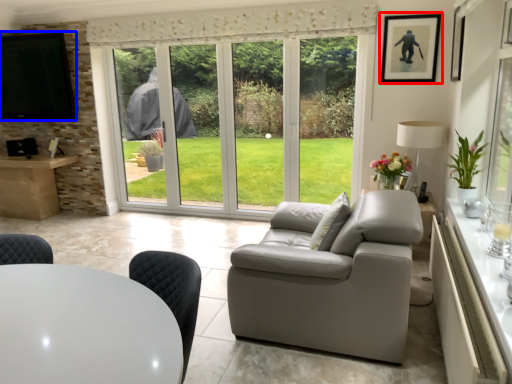
Question: Which of the following is the closest to the observer, picture frame (highlighted by a red box) or window screen (highlighted by a blue box)?

Choices:
 (A) picture frame
 (B) window screen

Answer: (A)